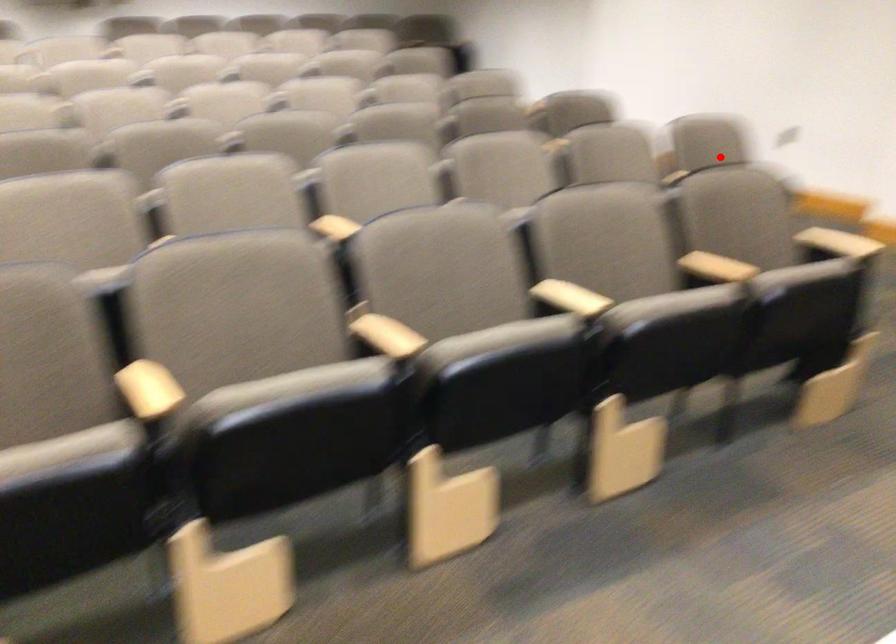
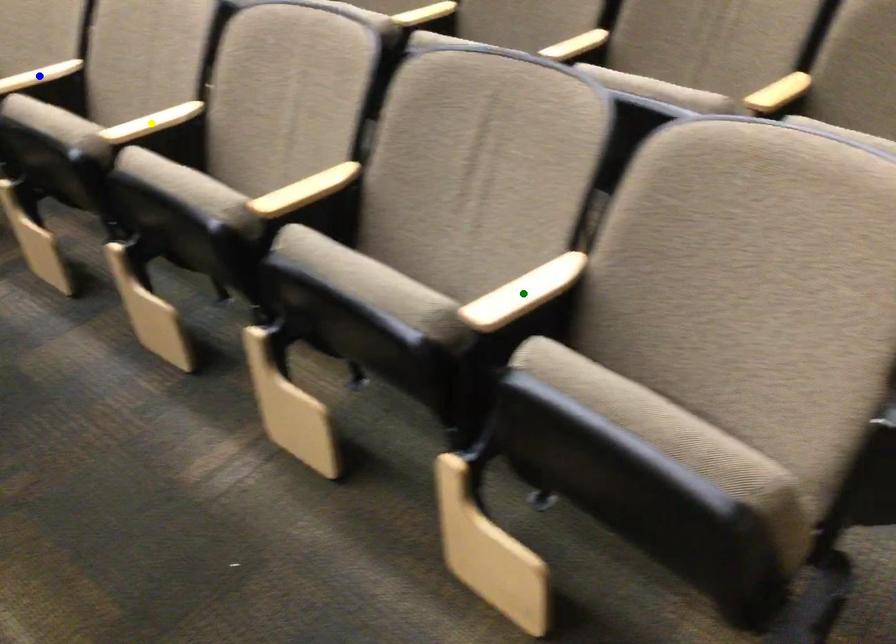
Question: I am providing you with two images of the same scene from different viewpoints. A red point is marked on the first image. You are given multiple points on the second image. Which point in image 2 is actually the same real-world point as the red point in image 1?

Choices:
 (A) blue point
 (B) green point
 (C) yellow point

Answer: (B)